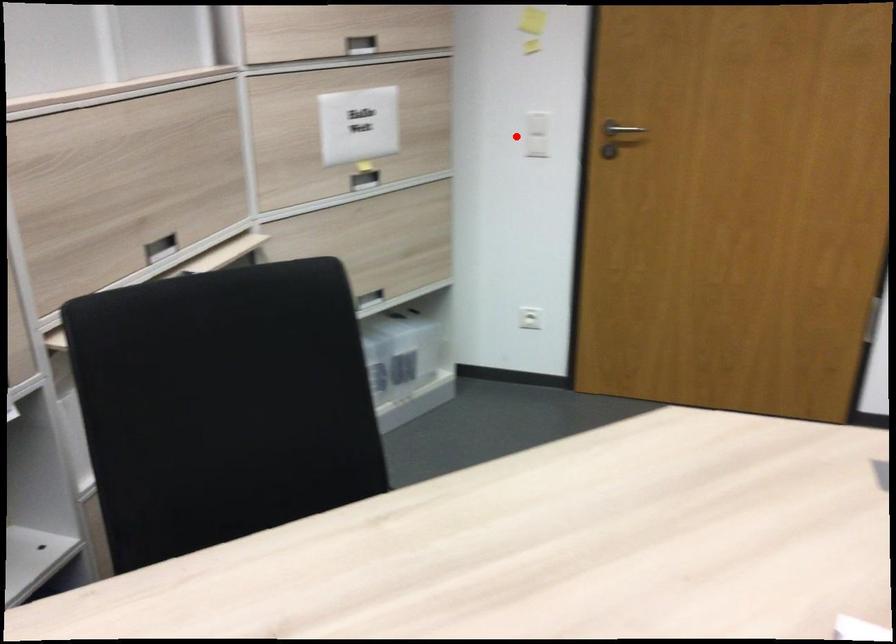
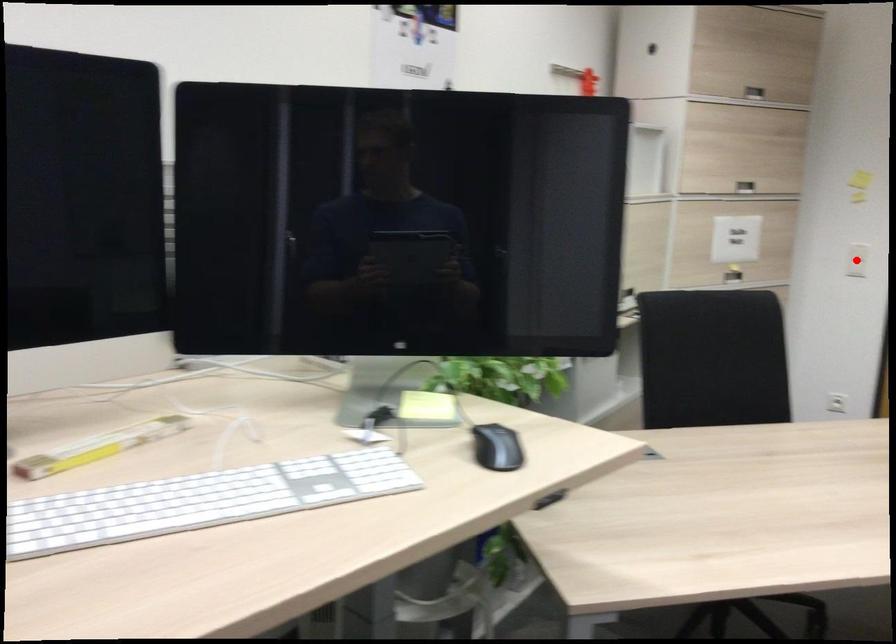
I am providing you with two images of the same scene from different viewpoints. A red point is marked on the first image and another point is marked on the second image. Does the point marked in image1 correspond to the same location as the one in image2?

Yes